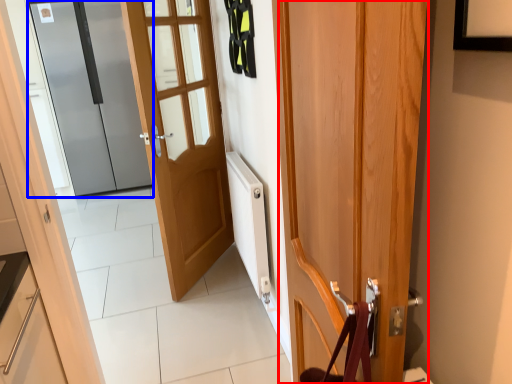
Question: Which object appears closest to the camera in this image, door (highlighted by a red box) or door (highlighted by a blue box)?

Choices:
 (A) door
 (B) door

Answer: (A)